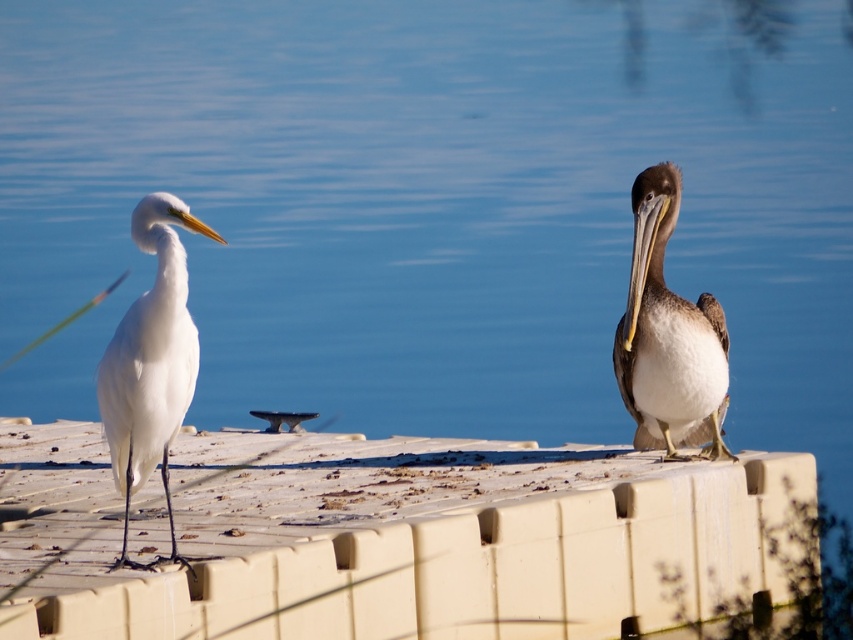
Question: Which point is farther to the camera?

Choices:
 (A) brown feathered pelican at right
 (B) white plastic dock at center
 (C) white matte bird at left

Answer: (B)

Question: Can you confirm if white plastic dock at center is bigger than white matte bird at left?

Choices:
 (A) no
 (B) yes

Answer: (A)

Question: Which of these objects is positioned farthest from the white plastic dock at center?

Choices:
 (A) white matte bird at left
 (B) brown feathered pelican at right

Answer: (A)

Question: Considering the relative positions of white plastic dock at center and white matte bird at left in the image provided, where is white plastic dock at center located with respect to white matte bird at left?

Choices:
 (A) below
 (B) above

Answer: (A)

Question: Is white plastic dock at center to the left of brown feathered pelican at right from the viewer's perspective?

Choices:
 (A) yes
 (B) no

Answer: (A)

Question: Which object is positioned closest to the white plastic dock at center?

Choices:
 (A) brown feathered pelican at right
 (B) white matte bird at left

Answer: (A)